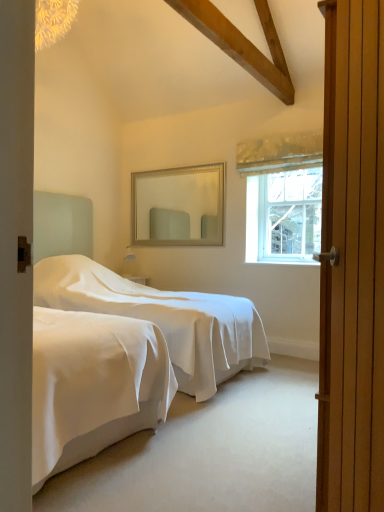
Question: From the image's perspective, is clear glass window at upper right on wooden door at right?

Choices:
 (A) no
 (B) yes

Answer: (B)

Question: Can you confirm if clear glass window at upper right is bigger than wooden door at right?

Choices:
 (A) yes
 (B) no

Answer: (B)

Question: Would you consider clear glass window at upper right to be distant from wooden door at right?

Choices:
 (A) yes
 (B) no

Answer: (A)

Question: Is clear glass window at upper right not within wooden door at right?

Choices:
 (A) yes
 (B) no

Answer: (A)

Question: Is clear glass window at upper right to the left of wooden door at right from the viewer's perspective?

Choices:
 (A) no
 (B) yes

Answer: (A)

Question: From a real-world perspective, relative to silver/golden frame mirror at upper center, is wooden door at right vertically above or below?

Choices:
 (A) above
 (B) below

Answer: (B)

Question: In terms of size, does wooden door at right appear bigger or smaller than silver/golden frame mirror at upper center?

Choices:
 (A) big
 (B) small

Answer: (A)

Question: Which is correct: wooden door at right is inside silver/golden frame mirror at upper center, or outside of it?

Choices:
 (A) inside
 (B) outside

Answer: (B)

Question: From the image's perspective, relative to silver/golden frame mirror at upper center, is wooden door at right above or below?

Choices:
 (A) below
 (B) above

Answer: (A)

Question: From the image's perspective, is clear glass window at upper right above or below silver/golden frame mirror at upper center?

Choices:
 (A) above
 (B) below

Answer: (B)

Question: Does point (301, 196) appear closer or farther from the camera than point (140, 207)?

Choices:
 (A) farther
 (B) closer

Answer: (B)

Question: Looking at the image, does clear glass window at upper right seem bigger or smaller compared to silver/golden frame mirror at upper center?

Choices:
 (A) small
 (B) big

Answer: (A)

Question: Relative to silver/golden frame mirror at upper center, is clear glass window at upper right in front or behind?

Choices:
 (A) front
 (B) behind

Answer: (A)

Question: Is silver/golden frame mirror at upper center taller or shorter than clear glass window at upper right?

Choices:
 (A) short
 (B) tall

Answer: (A)

Question: Choose the correct answer: Is silver/golden frame mirror at upper center inside clear glass window at upper right or outside it?

Choices:
 (A) outside
 (B) inside

Answer: (A)